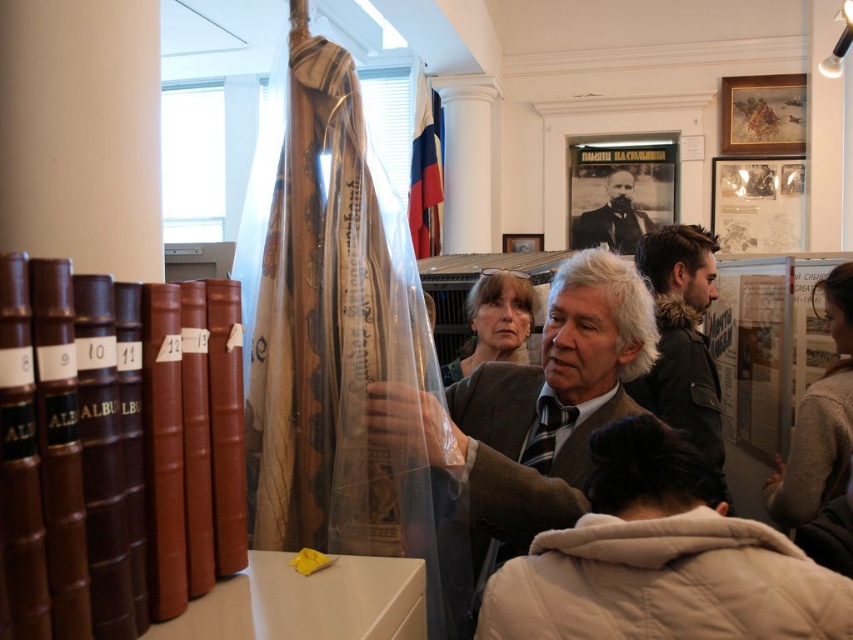
Question: Which object is positioned closest to the beige wool coat at lower right?

Choices:
 (A) matte gray jacket at center
 (B) smooth black suit at center

Answer: (A)

Question: Is brown leather book at left positioned at the back of matte brown suit at center?

Choices:
 (A) yes
 (B) no

Answer: (B)

Question: Which point is closer to the camera?

Choices:
 (A) beige wool coat at lower right
 (B) matte brown suit at center
 (C) matte gray jacket at center

Answer: (A)

Question: Is matte brown suit at center above smooth black suit at center?

Choices:
 (A) no
 (B) yes

Answer: (A)

Question: Among these objects, which one is farthest from the camera?

Choices:
 (A) matte gray jacket at center
 (B) brown leather book at left
 (C) matte brown suit at center
 (D) smooth black suit at center

Answer: (D)

Question: Considering the relative positions of brown leather book at left and matte brown suit at center in the image provided, where is brown leather book at left located with respect to matte brown suit at center?

Choices:
 (A) right
 (B) left

Answer: (B)